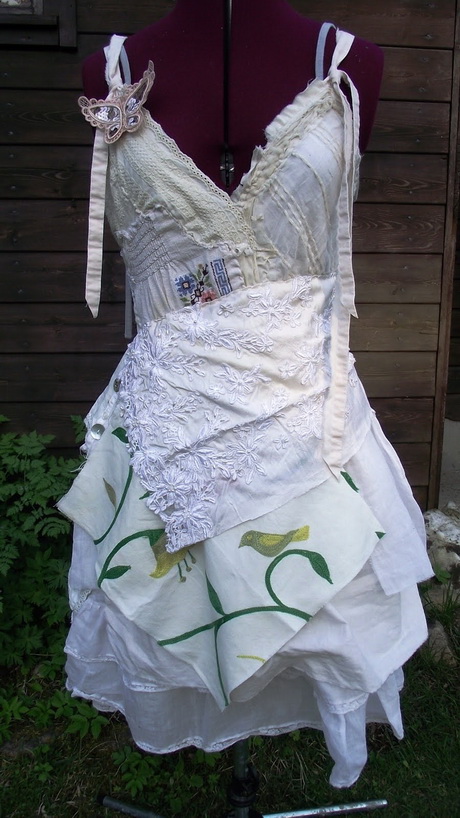
Locate an element on the screen. This screenshot has height=818, width=460. wooden wall is located at coordinates (401, 326), (418, 111), (402, 372).